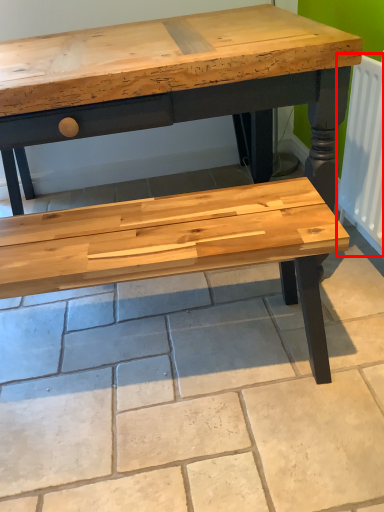
Question: Considering the relative positions of radiator (annotated by the red box) and tile in the image provided, where is radiator (annotated by the red box) located with respect to the staircase?

Choices:
 (A) right
 (B) left

Answer: (A)